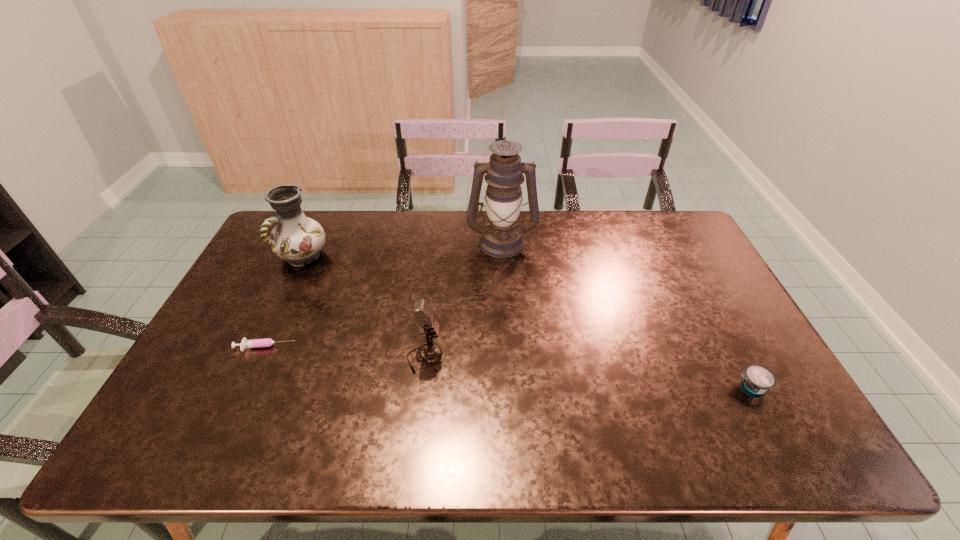
The width and height of the screenshot is (960, 540). Identify the location of blank space located 0.330m on the front-facing side of the third object from right to left. (570, 357).

I want to click on blank space located 0.380m on the left of the nearest object, so click(x=584, y=386).

Locate an element on the screen. The height and width of the screenshot is (540, 960). blank space located 0.270m on the right of the shortest object is located at coordinates (395, 348).

The width and height of the screenshot is (960, 540). I want to click on oil lamp that is at the far edge, so click(502, 237).

The width and height of the screenshot is (960, 540). I want to click on vase that is at the far edge, so click(x=297, y=239).

What are the coordinates of `vase located in the left edge section of the desktop` in the screenshot? It's located at tap(297, 239).

This screenshot has width=960, height=540. In order to click on syringe positioned at the left edge in this screenshot , I will do `click(266, 342)`.

Find the location of `object that is at the right edge`. object that is at the right edge is located at coordinates (757, 379).

Where is `object located at the far left corner`? object located at the far left corner is located at coordinates tap(297, 239).

In order to click on vacant space at the far edge of the desktop in this screenshot , I will do (558, 225).